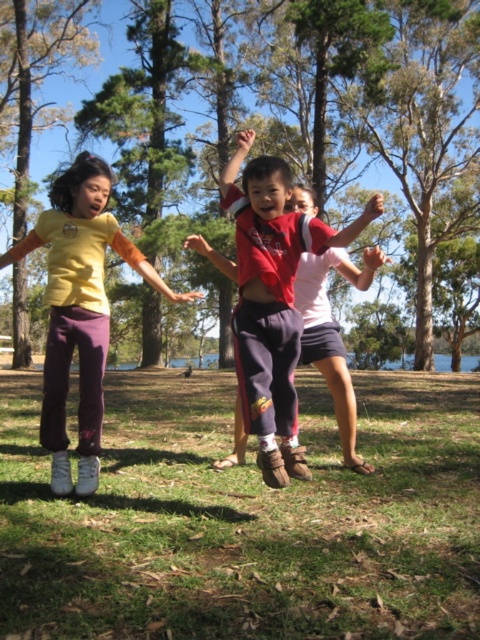
Who is lower down, green grass at lower center or reddish-brown cotton shorts at center?

Positioned lower is green grass at lower center.

Is green grass at lower center thinner than reddish-brown cotton shorts at center?

No.

Does point (59, 592) lie in front of point (297, 452)?

Yes, it is.

Locate an element on the screen. This screenshot has height=640, width=480. green grass at lower center is located at coordinates (245, 518).

Does reddish-brown cotton shorts at center have a smaller size compared to matte yellow shirt at center?

Incorrect, reddish-brown cotton shorts at center is not smaller in size than matte yellow shirt at center.

Is reddish-brown cotton shorts at center further to the viewer compared to matte yellow shirt at center?

No, it is not.

Is point (336, 246) farther from camera compared to point (101, 356)?

That is False.

The height and width of the screenshot is (640, 480). Identify the location of reddish-brown cotton shorts at center. (272, 296).

Is green grass at lower center positioned behind matte yellow shirt at center?

No, green grass at lower center is closer to the viewer.

Looking at this image, who is more distant from viewer, (320, 595) or (97, 385)?

Point (97, 385)

Locate an element on the screen. The image size is (480, 640). green grass at lower center is located at coordinates (245, 518).